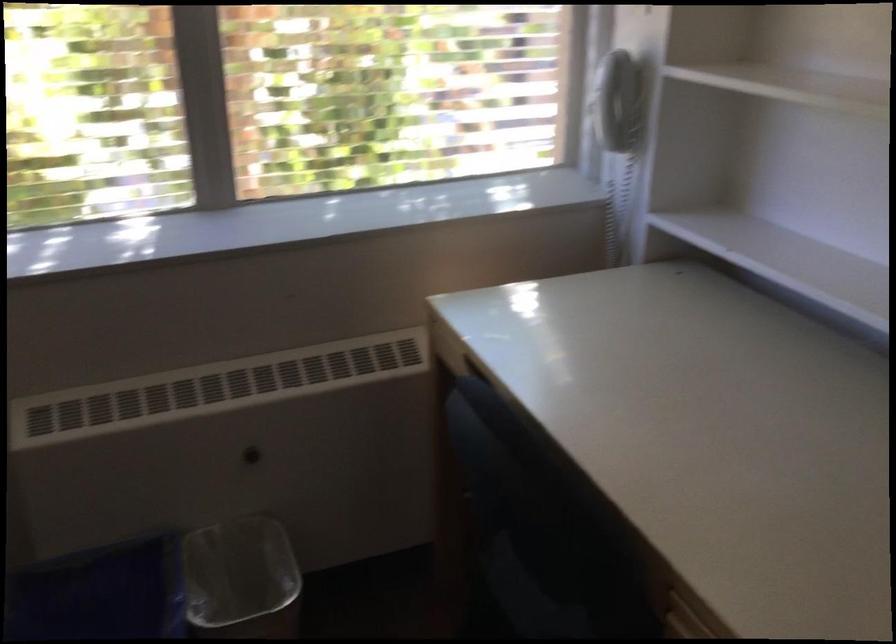
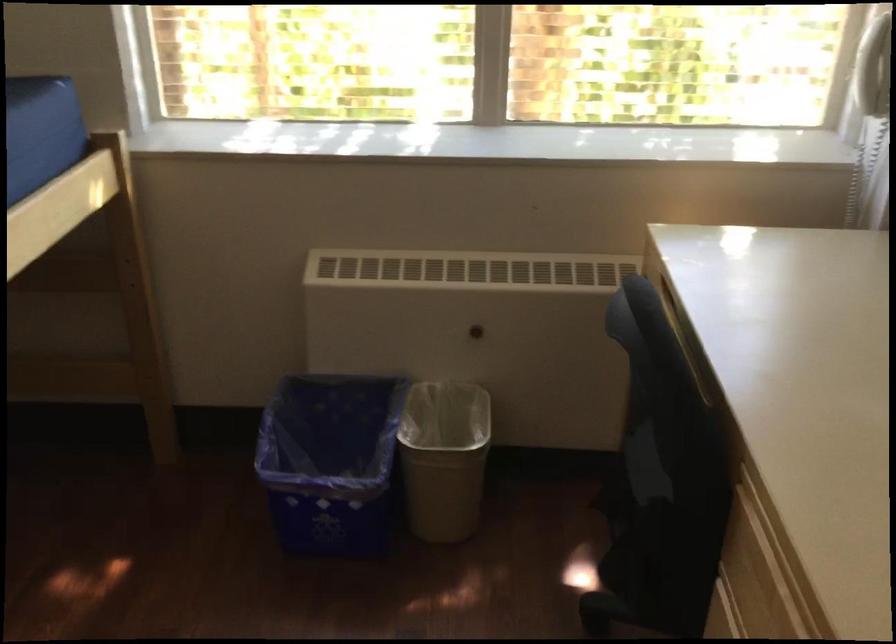
The point at [261,453] is marked in the first image. Where is the corresponding point in the second image?

(476, 330)